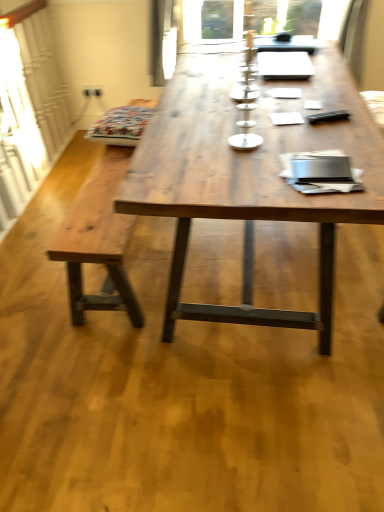
Find the location of a particular element. free spot to the right of wooden bench at left is located at coordinates (266, 262).